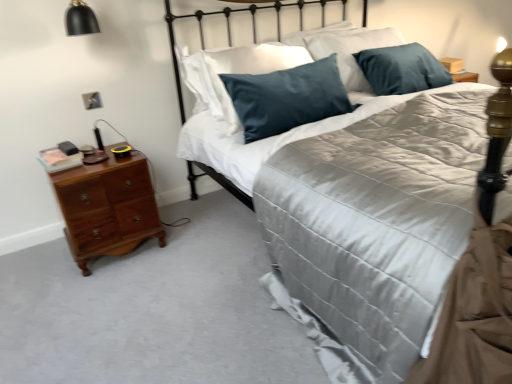
Locate an element on the screen. The height and width of the screenshot is (384, 512). free region on the left part of cherry wood nightstand at left is located at coordinates [32, 261].